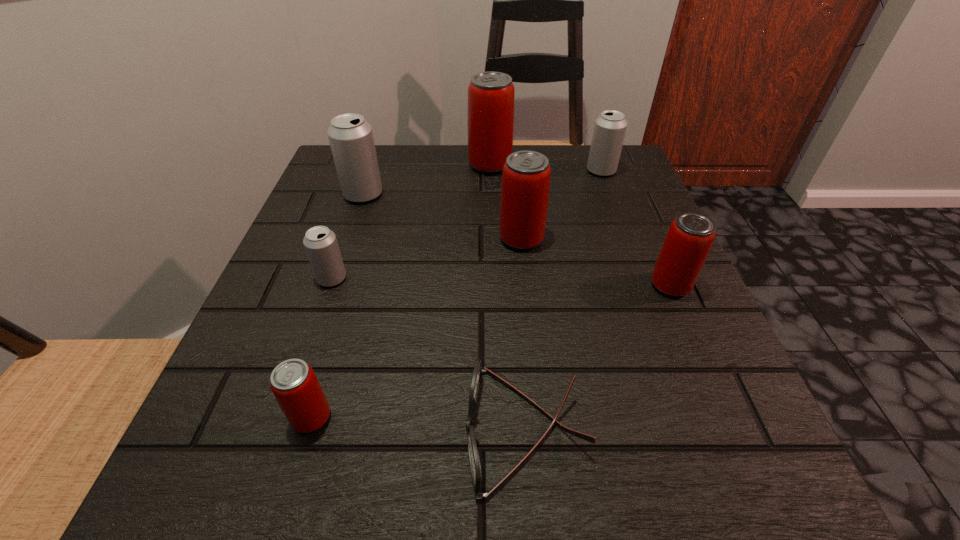
Identify the location of free area in between the third farthest beer can and the fifth nearest object. This screenshot has width=960, height=540. (443, 217).

Identify which object is located as the fifth nearest to the second farthest white beer can. Please provide its 2D coordinates. Your answer should be formatted as a tuple, i.e. [(x, y)], where the tuple contains the x and y coordinates of a point satisfying the conditions above.

[(294, 384)]

Identify which object is the third nearest to the leftmost pink beer can. Please provide its 2D coordinates. Your answer should be formatted as a tuple, i.e. [(x, y)], where the tuple contains the x and y coordinates of a point satisfying the conditions above.

[(526, 175)]

Point out which beer can is positioned as the sixth nearest to the nearest pink beer can. Please provide its 2D coordinates. Your answer should be formatted as a tuple, i.e. [(x, y)], where the tuple contains the x and y coordinates of a point satisfying the conditions above.

[(609, 131)]

Image resolution: width=960 pixels, height=540 pixels. Identify the location of beer can that can be found as the fourth closest to the third farthest beer can. (294, 384).

You are a GUI agent. You are given a task and a screenshot of the screen. Output one action in this format:
    pyautogui.click(x=<x>, y=<y>)
    Task: Click on the pink beer can that stands as the third closest to the smallest white beer can
    
    Given the screenshot: What is the action you would take?
    pos(491,95)

Locate which pink beer can is the second closest to the smallest white beer can. Please provide its 2D coordinates. Your answer should be formatted as a tuple, i.e. [(x, y)], where the tuple contains the x and y coordinates of a point satisfying the conditions above.

[(526, 175)]

Locate which white beer can ranks in proximity to the sixth nearest object. Please provide its 2D coordinates. Your answer should be formatted as a tuple, i.e. [(x, y)], where the tuple contains the x and y coordinates of a point satisfying the conditions above.

[(320, 243)]

This screenshot has width=960, height=540. I want to click on the second closest white beer can to the nearest beer can, so click(x=351, y=139).

Identify the location of vacant space that satisfies the following two spatial constraints: 1. on the back side of the biggest white beer can; 2. on the left side of the tallest beer can. The image size is (960, 540). (372, 165).